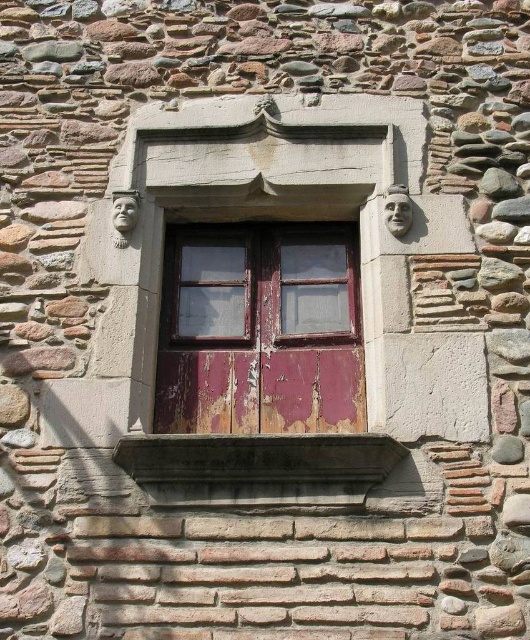
Question: In this image, where is peeling paint wooden window at center located relative to smooth stone window sill at center?

Choices:
 (A) above
 (B) below

Answer: (A)

Question: Does peeling paint wooden window at center appear over smooth stone window sill at center?

Choices:
 (A) no
 (B) yes

Answer: (B)

Question: Considering the real-world distances, which object is closest to the wooden window at center?

Choices:
 (A) smooth stone window sill at center
 (B) peeling paint wooden window at center

Answer: (B)

Question: Is peeling paint wooden window at center wider than smooth stone window sill at center?

Choices:
 (A) no
 (B) yes

Answer: (A)

Question: Which point is farther to the camera?

Choices:
 (A) smooth stone window sill at center
 (B) wooden window at center
 (C) peeling paint wooden window at center

Answer: (B)

Question: Which object appears closest to the camera in this image?

Choices:
 (A) peeling paint wooden window at center
 (B) smooth stone window sill at center
 (C) wooden window at center

Answer: (B)